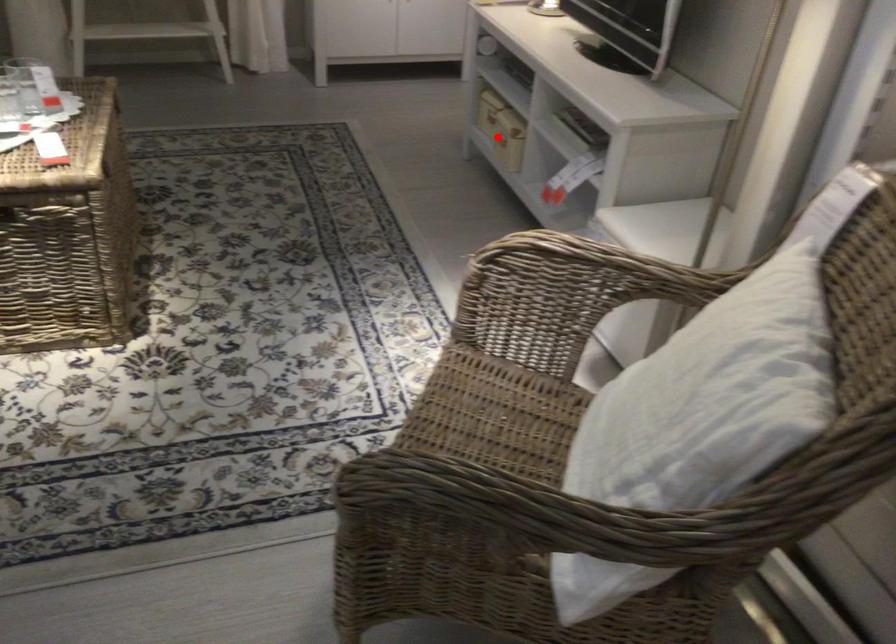
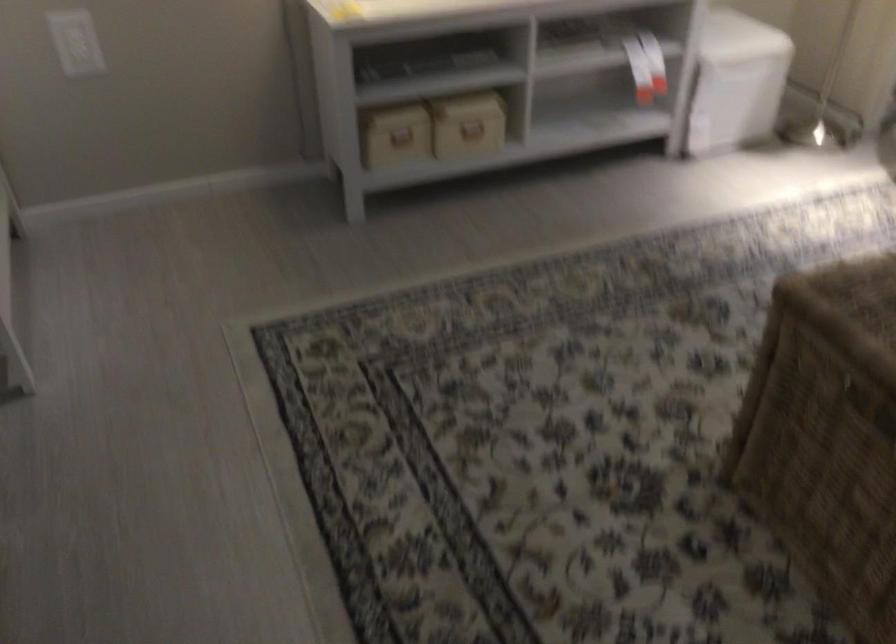
Question: I am providing you with two images of the same scene from different viewpoints. Given a red point in image1, look at the same physical point in image2. Is it:

Choices:
 (A) Closer to the viewpoint
 (B) Farther from the viewpoint

Answer: (A)